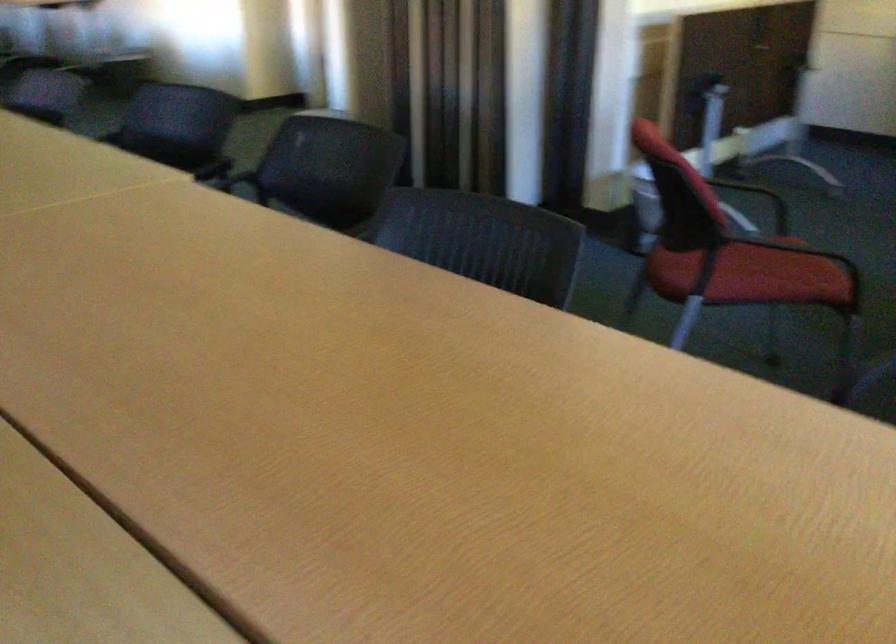
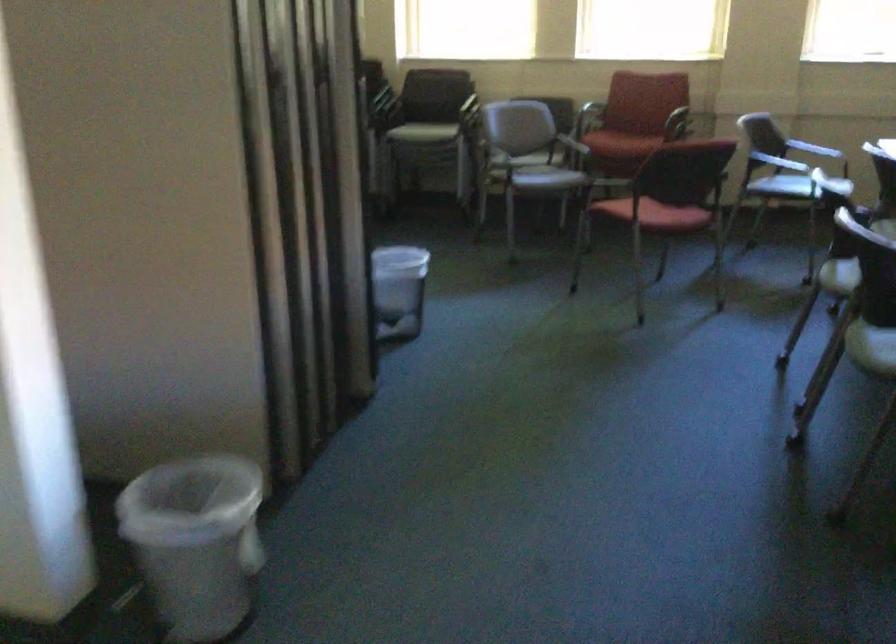
The point at (686, 259) is marked in the first image. Where is the corresponding point in the second image?

(660, 214)